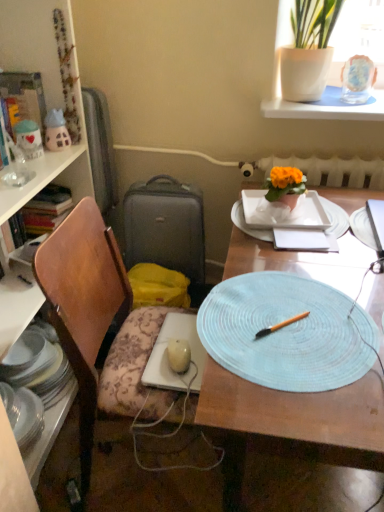
Question: Considering the relative sizes of light blue woven placemat at center and wooden bookcase at left in the image provided, is light blue woven placemat at center smaller than wooden bookcase at left?

Choices:
 (A) no
 (B) yes

Answer: (A)

Question: From the image's perspective, is light blue woven placemat at center on wooden bookcase at left?

Choices:
 (A) no
 (B) yes

Answer: (A)

Question: From a real-world perspective, is light blue woven placemat at center below wooden bookcase at left?

Choices:
 (A) yes
 (B) no

Answer: (A)

Question: Is wooden bookcase at left surrounded by light blue woven placemat at center?

Choices:
 (A) yes
 (B) no

Answer: (B)

Question: Is light blue woven placemat at center closer to camera compared to wooden bookcase at left?

Choices:
 (A) yes
 (B) no

Answer: (A)

Question: Is light blue woven placemat at center behind wooden bookcase at left?

Choices:
 (A) yes
 (B) no

Answer: (B)

Question: Considering the relative sizes of light blue woven placemat at center and light blue woven placemat at center, the 1th platter positioned from the front, in the image provided, is light blue woven placemat at center shorter than light blue woven placemat at center, the 1th platter positioned from the front,?

Choices:
 (A) yes
 (B) no

Answer: (B)

Question: From the image's perspective, is light blue woven placemat at center on light blue woven placemat at center, the second platter in the right-to-left sequence?

Choices:
 (A) yes
 (B) no

Answer: (B)

Question: Does light blue woven placemat at center have a larger size compared to light blue woven placemat at center, which is the second platter in back-to-front order?

Choices:
 (A) yes
 (B) no

Answer: (A)

Question: Is light blue woven placemat at center taller than light blue woven placemat at center, the 1th platter positioned from the front?

Choices:
 (A) no
 (B) yes

Answer: (B)

Question: Considering the relative positions of light blue woven placemat at center and light blue woven placemat at center, the 1th platter positioned from the front, in the image provided, is light blue woven placemat at center to the left of light blue woven placemat at center, the 1th platter positioned from the front, from the viewer's perspective?

Choices:
 (A) yes
 (B) no

Answer: (B)

Question: Considering the relative sizes of light blue woven placemat at center and light blue woven placemat at center, marked as the first platter in a left-to-right arrangement, in the image provided, is light blue woven placemat at center thinner than light blue woven placemat at center, marked as the first platter in a left-to-right arrangement,?

Choices:
 (A) no
 (B) yes

Answer: (A)

Question: Is light blue woven placemat at center completely or partially outside of white ceramic plate at center, the first plate from the top?

Choices:
 (A) no
 (B) yes

Answer: (B)